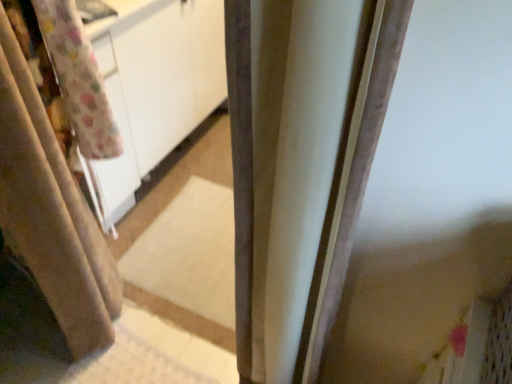
Identify the location of beige fabric curtain at left. This screenshot has height=384, width=512. click(x=51, y=212).

This screenshot has width=512, height=384. What do you see at coordinates (51, 212) in the screenshot? I see `beige fabric curtain at left` at bounding box center [51, 212].

Locate an element on the screen. The image size is (512, 384). beige fabric curtain at left is located at coordinates (51, 212).